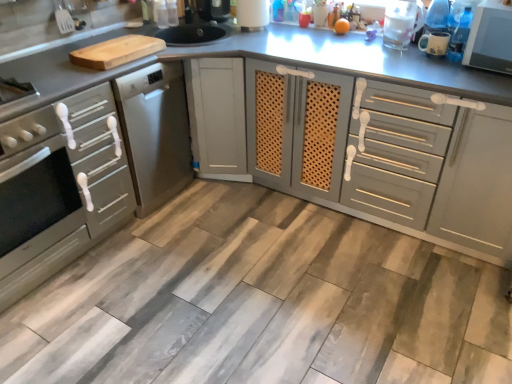
You are a GUI agent. You are given a task and a screenshot of the screen. Output one action in this format:
    pyautogui.click(x=<x>, y=<y>)
    Task: Click on the vacant area that is in front of matte white mug at upper right, which is the first appliance in front-to-back order
    The width and height of the screenshot is (512, 384).
    Given the screenshot: What is the action you would take?
    pyautogui.click(x=438, y=69)